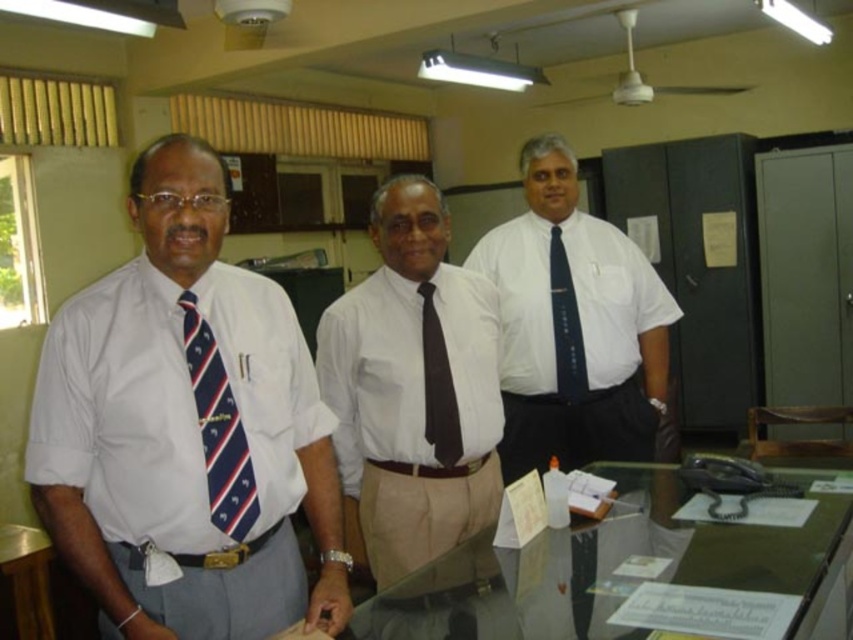
Is transparent glass table at center wider than glossy wood table at lower left?

Indeed, transparent glass table at center has a greater width compared to glossy wood table at lower left.

Does transparent glass table at center have a lesser width compared to glossy wood table at lower left?

Incorrect, transparent glass table at center's width is not less than glossy wood table at lower left's.

The width and height of the screenshot is (853, 640). In order to click on transparent glass table at center in this screenshot , I will do `click(607, 566)`.

Where is `transparent glass table at center`? The image size is (853, 640). transparent glass table at center is located at coordinates (607, 566).

Is white shirt at left smaller than blue striped tie at center?

Actually, white shirt at left might be larger than blue striped tie at center.

Which is in front, point (323, 529) or point (560, 269)?

Point (323, 529) is more forward.

Is point (334, 460) behind point (573, 372)?

No, (334, 460) is in front of (573, 372).

The height and width of the screenshot is (640, 853). What are the coordinates of `white shirt at left` in the screenshot? It's located at (184, 426).

The width and height of the screenshot is (853, 640). Describe the element at coordinates (184, 426) in the screenshot. I see `white shirt at left` at that location.

Does point (80, 310) come closer to viewer compared to point (631, 349)?

Yes, it is.

Locate an element on the screen. This screenshot has height=640, width=853. white shirt at left is located at coordinates (184, 426).